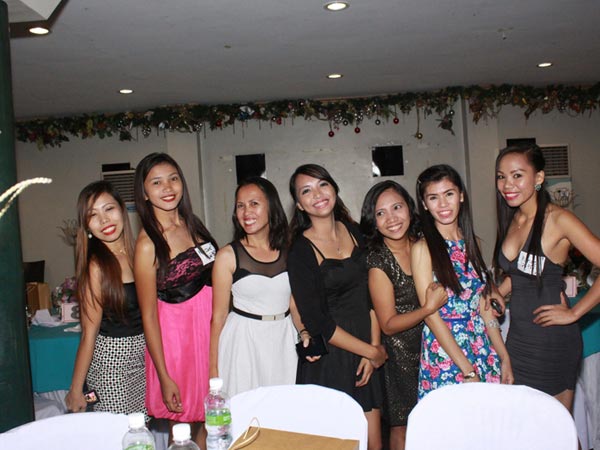
Find the location of a particular element. white plastic chairs is located at coordinates (75, 429), (292, 405), (511, 422).